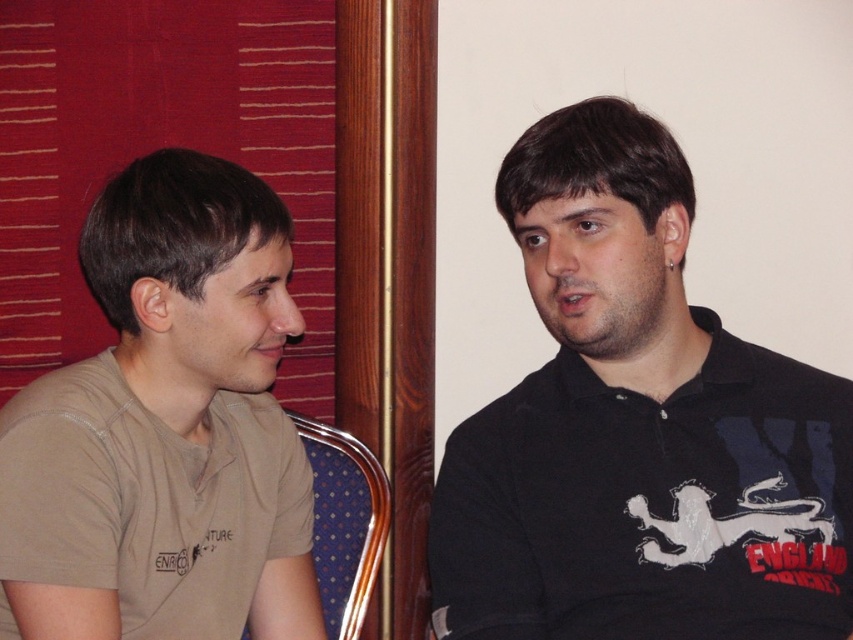
Question: Among these points, which one is nearest to the camera?

Choices:
 (A) (83, 506)
 (B) (386, 525)
 (C) (585, 104)

Answer: (A)

Question: Among these points, which one is farthest from the camera?

Choices:
 (A) (566, 128)
 (B) (152, 476)
 (C) (334, 513)

Answer: (C)

Question: From the image, what is the correct spatial relationship of black matte shirt at right in relation to beige cotton t-shirt at left?

Choices:
 (A) below
 (B) above

Answer: (B)

Question: Observing the image, what is the correct spatial positioning of black matte shirt at right in reference to blue fabric chair at left?

Choices:
 (A) right
 (B) left

Answer: (A)

Question: Is black matte shirt at right further to the viewer compared to beige cotton t-shirt at left?

Choices:
 (A) yes
 (B) no

Answer: (A)

Question: Which of the following is the closest to the observer?

Choices:
 (A) (784, 515)
 (B) (161, 321)

Answer: (B)